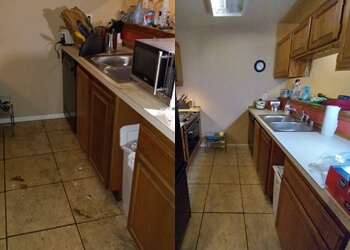
What are the coordinates of `double sink` in the screenshot? It's located at (286, 126).